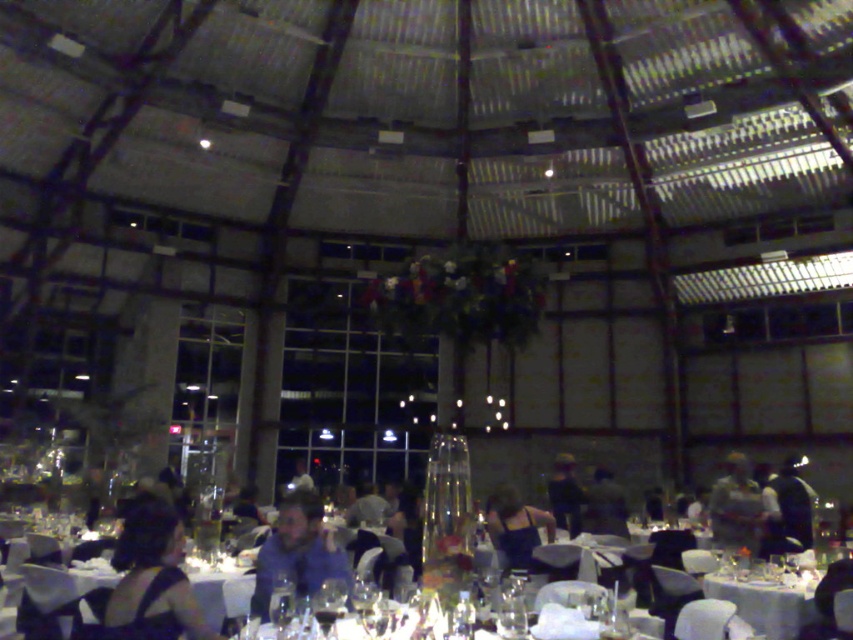
Is white glossy table at center to the right of silvery metallic dress at center from the viewer's perspective?

Incorrect, white glossy table at center is not on the right side of silvery metallic dress at center.

Does point (792, 618) come behind point (721, 506)?

No, it is not.

The height and width of the screenshot is (640, 853). What do you see at coordinates (764, 602) in the screenshot? I see `white glossy table at center` at bounding box center [764, 602].

I want to click on white glossy table at center, so click(x=764, y=602).

Is white glossy table at center positioned behind dark blue shirt at center?

No, white glossy table at center is closer to the viewer.

Does point (753, 616) lie behind point (802, 529)?

No, it is in front of (802, 529).

The height and width of the screenshot is (640, 853). What do you see at coordinates (764, 602) in the screenshot?
I see `white glossy table at center` at bounding box center [764, 602].

This screenshot has height=640, width=853. Identify the location of white glossy table at center. (764, 602).

Between black satin dress at lower left and dark blue fabric jacket at center, which one appears on the left side from the viewer's perspective?

black satin dress at lower left

Is the position of black satin dress at lower left more distant than that of dark blue fabric jacket at center?

No, black satin dress at lower left is closer to the viewer.

Between point (177, 612) and point (566, 490), which one is positioned in front?

Point (177, 612) is more forward.

Find the location of a particular element. black satin dress at lower left is located at coordinates (154, 580).